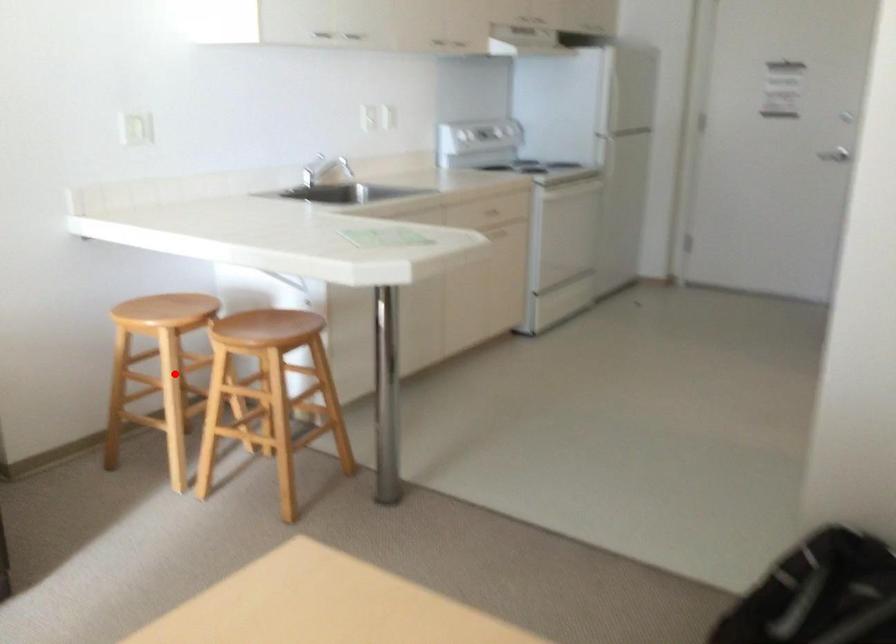
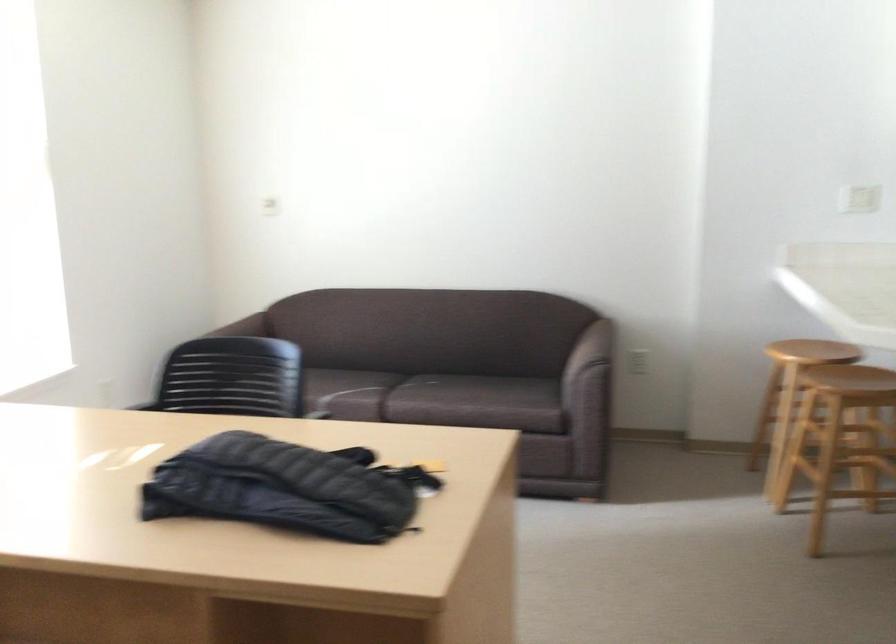
Where in the second image is the point corresponding to the highlighted location from the first image?

(789, 395)